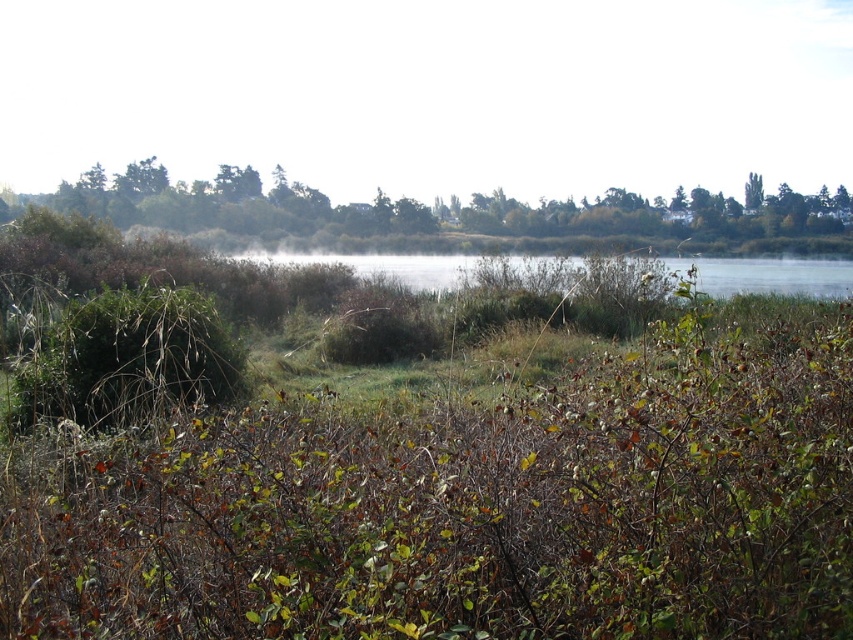
Consider the image. You are standing at the edge of the water in the middle ground. You want to walk to the green leafy trees at upper center located at point (442, 216). What direction should you head?

The green leafy trees at upper center is located at point (442, 216), so you should head towards the upper center direction to reach them.

You are standing in the serene landscape and want to take a photo of the green leafy trees at upper center. Based on their position, which direction should you face to capture them in your view?

The green leafy trees at upper center are located at coordinates point (442, 216), which places them in the upper center area of the scene. To capture them in your view, you should face towards the upper center direction.